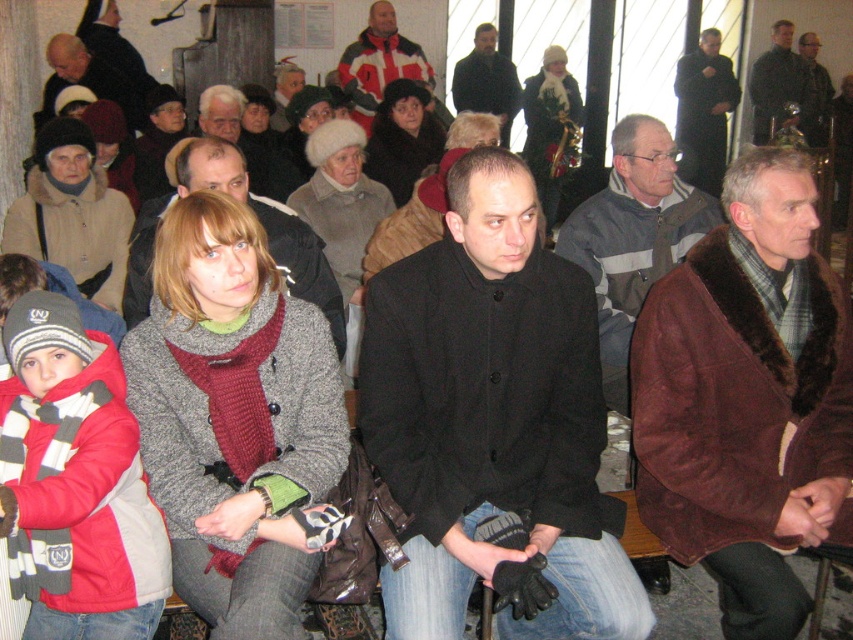
Does black wool coat at upper right have a greater width compared to matte black jacket at upper left?

In fact, black wool coat at upper right might be narrower than matte black jacket at upper left.

Can you confirm if black wool coat at upper right is positioned above matte black jacket at upper left?

Correct, black wool coat at upper right is located above matte black jacket at upper left.

Where is `black wool coat at upper right`? This screenshot has height=640, width=853. black wool coat at upper right is located at coordinates (704, 112).

I want to click on black wool coat at upper right, so click(704, 112).

Between gray striped sweater at center and dark gray wool coat at upper right, which one has less height?

gray striped sweater at center

Who is more distant from viewer, (660, 253) or (784, 51)?

The point (784, 51) is more distant.

You are a GUI agent. You are given a task and a screenshot of the screen. Output one action in this format:
    pyautogui.click(x=<x>, y=<y>)
    Task: Click on the gray striped sweater at center
    This screenshot has width=853, height=640.
    Given the screenshot: What is the action you would take?
    pyautogui.click(x=633, y=236)

Is camouflage jacket at upper right shorter than matte black jacket at center?

No, camouflage jacket at upper right is not shorter than matte black jacket at center.

What do you see at coordinates (813, 92) in the screenshot?
I see `camouflage jacket at upper right` at bounding box center [813, 92].

Where is `camouflage jacket at upper right`? camouflage jacket at upper right is located at coordinates (813, 92).